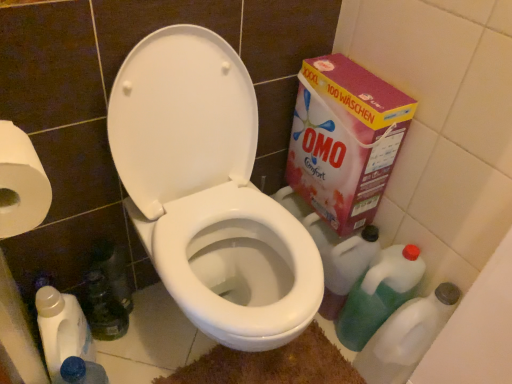
Question: Looking at their shapes, would you say pink cardboard box at right is wider or thinner than green translucent bottle at lower right, placed as the 3th cleaning product when sorted from left to right?

Choices:
 (A) wide
 (B) thin

Answer: (B)

Question: Based on their sizes in the image, would you say pink cardboard box at right is bigger or smaller than green translucent bottle at lower right, placed as the 3th cleaning product when sorted from left to right?

Choices:
 (A) small
 (B) big

Answer: (B)

Question: Considering the real-world distances, which object is closest to the brown textured bath mat at lower center?

Choices:
 (A) pink cardboard box at right
 (B) green plastic cleaner at lower right, placed as the 4th cleaning product when sorted from left to right
 (C) translucent plastic bottle at lower left
 (D) white glossy toilet at center
 (E) green translucent bottle at lower right, which ranks as the second cleaning product in right-to-left order

Answer: (B)

Question: Which object is the closest to the green plastic cleaner at lower right, which ranks as the third cleaning product in right-to-left order?

Choices:
 (A) translucent plastic bottle at lower left
 (B) pink cardboard box at right
 (C) white plastic bottle at lower left, marked as the 1th cleaning product in a left-to-right arrangement
 (D) green plastic cleaner at lower right, which is counted as the first cleaning product, starting from the right
 (E) white paper at left

Answer: (D)